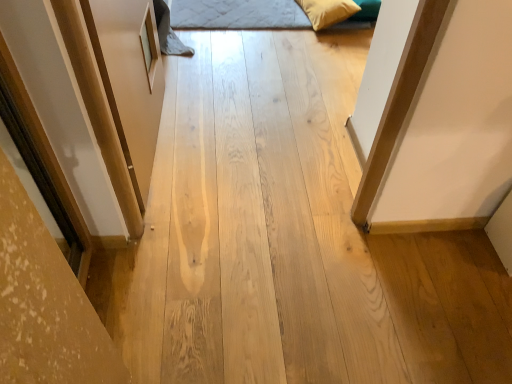
I want to click on free space on the front side of quilted fabric bed at upper center, so click(263, 85).